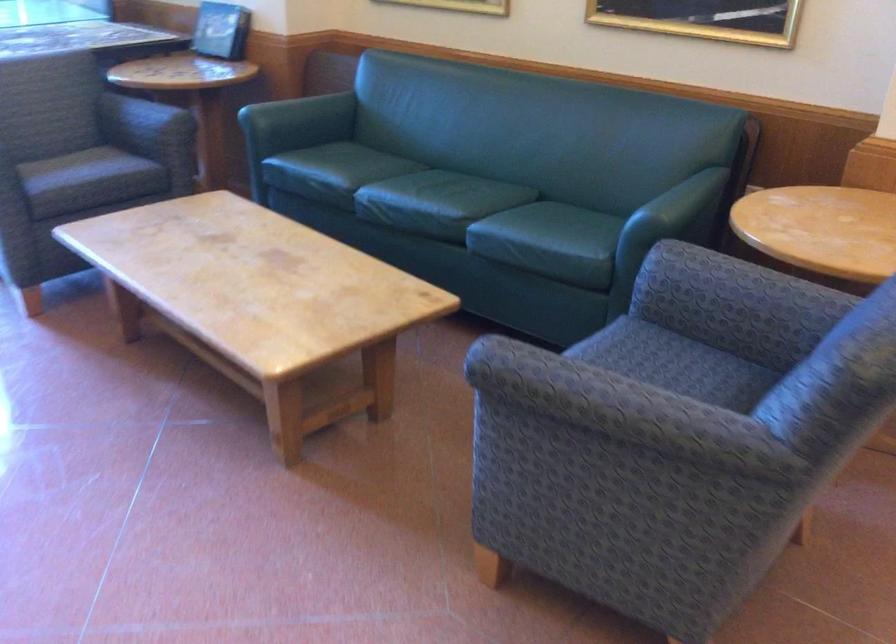
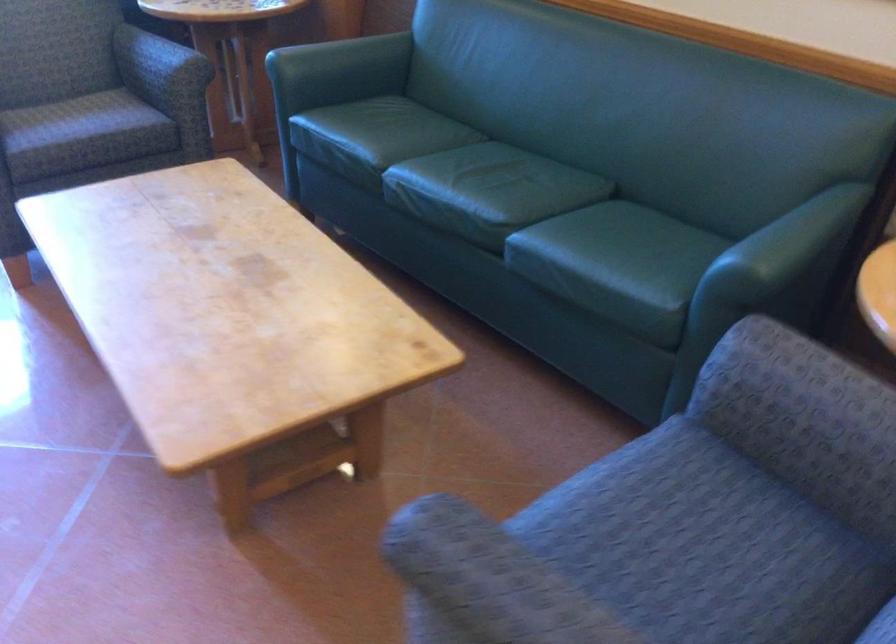
Find the pixel in the second image that matches (685,196) in the first image.

(791, 238)